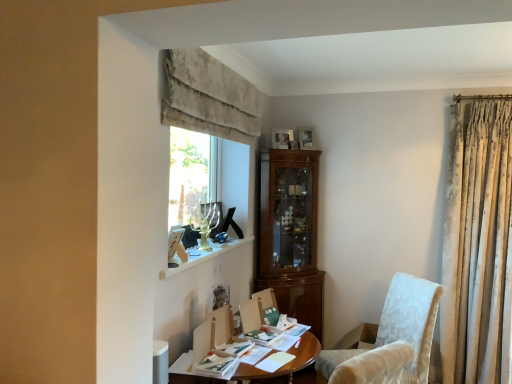
The width and height of the screenshot is (512, 384). Identify the location of white marble window sill at upper center. (201, 256).

What do you see at coordinates (306, 138) in the screenshot? The image size is (512, 384). I see `wooden picture frame at upper center, which ranks as the second picture frame in left-to-right order` at bounding box center [306, 138].

Find the location of a particular element. This screenshot has height=384, width=512. wooden desk at center is located at coordinates (286, 366).

Describe the element at coordinates (391, 339) in the screenshot. This screenshot has width=512, height=384. I see `white textured fabric chair at lower right` at that location.

Find the location of a particular element. velvet beige curtain at upper center is located at coordinates (208, 97).

The width and height of the screenshot is (512, 384). In order to click on white marble window sill at upper center in this screenshot , I will do `click(201, 256)`.

From the image's perspective, would you say wooden photo frame at upper center, arranged as the 1th picture frame when viewed from the front, is shown under velvet beige curtain at upper center?

Correct, wooden photo frame at upper center, arranged as the 1th picture frame when viewed from the front, appears lower than velvet beige curtain at upper center in the image.

Which of these two, wooden photo frame at upper center, which is the second picture frame in back-to-front order, or velvet beige curtain at upper center, stands shorter?

With less height is wooden photo frame at upper center, which is the second picture frame in back-to-front order.

Which object is more forward, white marble window sill at upper center or velvet beige curtain at upper center?

velvet beige curtain at upper center is more forward.

Is point (225, 252) farther from camera compared to point (241, 77)?

No, (225, 252) is in front of (241, 77).

Is white marble window sill at upper center oriented towards velvet beige curtain at upper center?

No, white marble window sill at upper center is not oriented towards velvet beige curtain at upper center.

Measure the distance between white marble window sill at upper center and velvet beige curtain at upper center.

white marble window sill at upper center is 34.40 inches from velvet beige curtain at upper center.

Is white marble window sill at upper center at the back of wooden photo frame at upper center, arranged as the 1th picture frame when viewed from the front?

No, wooden photo frame at upper center, arranged as the 1th picture frame when viewed from the front, is not facing the opposite direction of white marble window sill at upper center.

In the scene shown: Who is shorter, wooden photo frame at upper center, placed as the 1th picture frame when sorted from left to right, or white marble window sill at upper center?

white marble window sill at upper center is shorter.

Which object is thinner, wooden photo frame at upper center, acting as the 2th picture frame starting from the right, or white marble window sill at upper center?

Thinner between the two is wooden photo frame at upper center, acting as the 2th picture frame starting from the right.

Considering the sizes of objects wooden picture frame at upper center, which ranks as the second picture frame in left-to-right order, and white textured fabric chair at lower right in the image provided, who is smaller, wooden picture frame at upper center, which ranks as the second picture frame in left-to-right order, or white textured fabric chair at lower right?

With smaller size is wooden picture frame at upper center, which ranks as the second picture frame in left-to-right order.

Is point (307, 141) positioned in front of point (401, 308)?

No.

From the image's perspective, is wooden picture frame at upper center, which is counted as the second picture frame, starting from the front, on top of white textured fabric chair at lower right?

Yes, from the image's perspective, wooden picture frame at upper center, which is counted as the second picture frame, starting from the front, is on top of white textured fabric chair at lower right.

Can you confirm if wooden picture frame at upper center, which ranks as the second picture frame in left-to-right order, is shorter than white textured fabric chair at lower right?

Indeed, wooden picture frame at upper center, which ranks as the second picture frame in left-to-right order, has a lesser height compared to white textured fabric chair at lower right.

The height and width of the screenshot is (384, 512). In order to click on window sill behind the wooden desk at center in this screenshot , I will do `click(201, 256)`.

Which object is positioned more to the left, white marble window sill at upper center or wooden desk at center?

Positioned to the left is white marble window sill at upper center.

Could you tell me if white marble window sill at upper center is facing wooden desk at center?

No, white marble window sill at upper center is not turned towards wooden desk at center.

From their relative heights in the image, would you say white marble window sill at upper center is taller or shorter than wooden desk at center?

In the image, white marble window sill at upper center appears to be shorter than wooden desk at center.

Looking at this image, between wooden picture frame at upper center, which ranks as the second picture frame in left-to-right order, and wooden desk at center, which one is positioned in front?

wooden desk at center is more forward.

Would you say wooden picture frame at upper center, which is counted as the first picture frame, starting from the right, is to the left or to the right of wooden desk at center in the picture?

From the image, it's evident that wooden picture frame at upper center, which is counted as the first picture frame, starting from the right, is to the right of wooden desk at center.

From a real-world perspective, is wooden picture frame at upper center, which ranks as the second picture frame in left-to-right order, below wooden desk at center?

No.

Would you say wooden desk at center is part of wooden picture frame at upper center, the first picture frame when ordered from back to front,'s contents?

No, wooden desk at center is not a part of wooden picture frame at upper center, the first picture frame when ordered from back to front.

Does point (275, 133) appear closer or farther from the camera than point (302, 145)?

Point (275, 133).

In order to click on picture frame that is below the wooden picture frame at upper center, which is counted as the second picture frame, starting from the front (from the image's perspective) in this screenshot , I will do `click(282, 138)`.

Which object is positioned more to the left, wooden photo frame at upper center, acting as the 2th picture frame starting from the right, or wooden picture frame at upper center, which is counted as the second picture frame, starting from the front?

From the viewer's perspective, wooden photo frame at upper center, acting as the 2th picture frame starting from the right, appears more on the left side.

Is wooden photo frame at upper center, which is the second picture frame in back-to-front order, taller or shorter than wooden picture frame at upper center, which ranks as the second picture frame in left-to-right order?

Clearly, wooden photo frame at upper center, which is the second picture frame in back-to-front order, is shorter compared to wooden picture frame at upper center, which ranks as the second picture frame in left-to-right order.

This screenshot has height=384, width=512. What are the coordinates of `curtain above the wooden photo frame at upper center, acting as the 2th picture frame starting from the right (from the image's perspective)` in the screenshot? It's located at (208, 97).

This screenshot has width=512, height=384. What are the coordinates of `window sill located underneath the velvet beige curtain at upper center (from a real-world perspective)` in the screenshot? It's located at (201, 256).

When comparing their distances from wooden picture frame at upper center, which is counted as the second picture frame, starting from the front, does wooden photo frame at upper center, arranged as the 1th picture frame when viewed from the front, or wooden desk at center seem closer?

wooden photo frame at upper center, arranged as the 1th picture frame when viewed from the front, is positioned closer to the anchor wooden picture frame at upper center, which is counted as the second picture frame, starting from the front.

Considering their positions, is white textured fabric chair at lower right positioned closer to wooden picture frame at upper center, the first picture frame when ordered from back to front, than velvet beige curtain at upper center?

velvet beige curtain at upper center lies closer to wooden picture frame at upper center, the first picture frame when ordered from back to front, than the other object.

From the image, which object appears to be farther from velvet beige curtain at upper center, white marble window sill at upper center or wooden photo frame at upper center, acting as the 2th picture frame starting from the right?

Based on the image, white marble window sill at upper center appears to be further to velvet beige curtain at upper center.

Looking at the image, which one is located closer to wooden desk at center, white textured fabric chair at lower right or wooden picture frame at upper center, which is counted as the first picture frame, starting from the right?

white textured fabric chair at lower right is closer to wooden desk at center.

From the image, which object appears to be farther from wooden photo frame at upper center, placed as the 1th picture frame when sorted from left to right, white textured fabric chair at lower right or velvet beige curtain at upper center?

white textured fabric chair at lower right is further to wooden photo frame at upper center, placed as the 1th picture frame when sorted from left to right.

Considering their positions, is wooden desk at center positioned further to wooden picture frame at upper center, which is counted as the second picture frame, starting from the front, than white textured fabric chair at lower right?

wooden desk at center is positioned further to the anchor wooden picture frame at upper center, which is counted as the second picture frame, starting from the front.

Based on their spatial positions, is wooden photo frame at upper center, placed as the 1th picture frame when sorted from left to right, or velvet beige curtain at upper center closer to wooden desk at center?

velvet beige curtain at upper center is positioned closer to the anchor wooden desk at center.

When comparing their distances from wooden photo frame at upper center, arranged as the 1th picture frame when viewed from the front, does wooden picture frame at upper center, which is counted as the second picture frame, starting from the front, or white textured fabric chair at lower right seem closer?

wooden picture frame at upper center, which is counted as the second picture frame, starting from the front, is positioned closer to the anchor wooden photo frame at upper center, arranged as the 1th picture frame when viewed from the front.

Find the location of `picture frame located between velvet beige curtain at upper center and wooden picture frame at upper center, which ranks as the second picture frame in left-to-right order, in the depth direction`. picture frame located between velvet beige curtain at upper center and wooden picture frame at upper center, which ranks as the second picture frame in left-to-right order, in the depth direction is located at coordinates (282, 138).

Image resolution: width=512 pixels, height=384 pixels. What are the coordinates of `window sill between wooden desk at center and wooden photo frame at upper center, acting as the 2th picture frame starting from the right, from front to back` in the screenshot? It's located at (201, 256).

Image resolution: width=512 pixels, height=384 pixels. What are the coordinates of `picture frame between wooden desk at center and wooden picture frame at upper center, which ranks as the second picture frame in left-to-right order, along the z-axis` in the screenshot? It's located at (282, 138).

Where is `chair located between wooden desk at center and wooden picture frame at upper center, which is counted as the first picture frame, starting from the right, in the depth direction`? The height and width of the screenshot is (384, 512). chair located between wooden desk at center and wooden picture frame at upper center, which is counted as the first picture frame, starting from the right, in the depth direction is located at coordinates (391, 339).